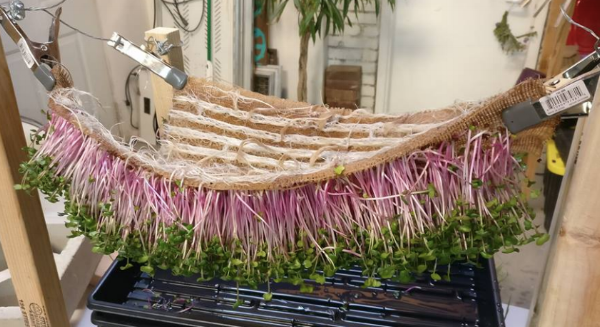
I want to click on wooden frames, so click(583, 212), click(30, 237), click(167, 48), click(550, 48).